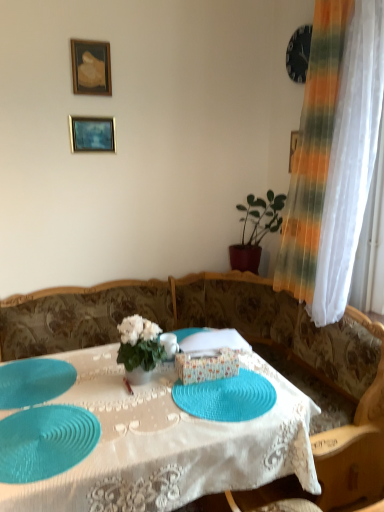
Find the location of a particular element. vacant area situated to the left side of white fabric flower at center is located at coordinates (97, 379).